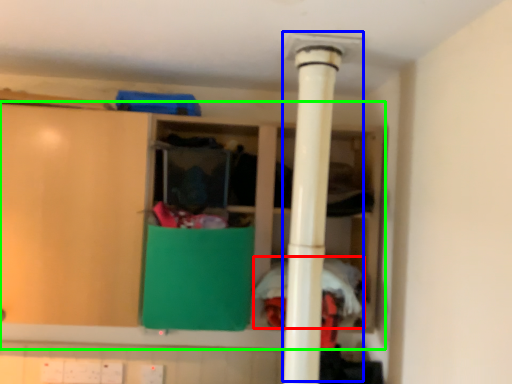
Question: Based on their relative distances, which object is farther from clothing (highlighted by a red box)? Choose from water heater (highlighted by a blue box) and cupboard (highlighted by a green box).

Choices:
 (A) water heater
 (B) cupboard

Answer: (B)